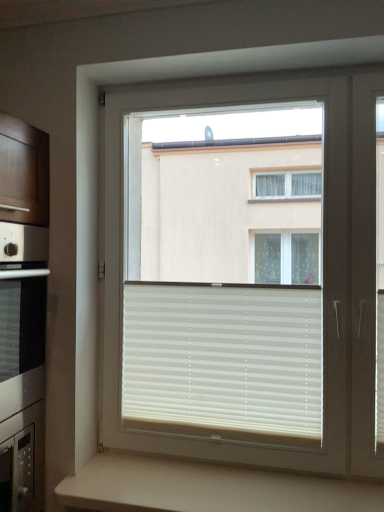
Locate an element on the screen. The width and height of the screenshot is (384, 512). blank space situated above beige matte counter at lower center (from a real-world perspective) is located at coordinates (221, 492).